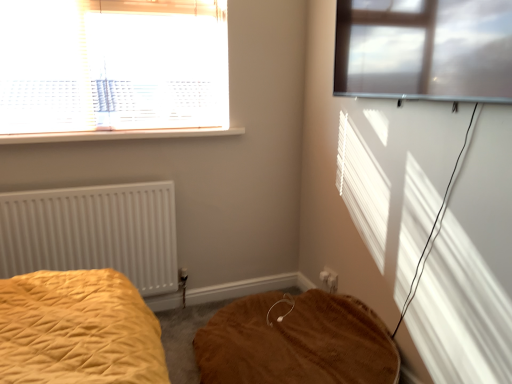
Question: Is white plastic window sill at upper left wider than white plastic window at upper left, positioned as the 2th window in right-to-left order?

Choices:
 (A) no
 (B) yes

Answer: (B)

Question: Is white plastic window sill at upper left not inside white plastic window at upper left, positioned as the 2th window in right-to-left order?

Choices:
 (A) no
 (B) yes

Answer: (B)

Question: Is the position of white plastic window sill at upper left more distant than that of white plastic window at upper left, placed as the first window when sorted from back to front?

Choices:
 (A) no
 (B) yes

Answer: (B)

Question: From the image's perspective, is white plastic window sill at upper left under white plastic window at upper left, the second window viewed from the front?

Choices:
 (A) yes
 (B) no

Answer: (A)

Question: Could white plastic window at upper left, the first window when ordered from left to right, be considered to be inside white plastic window sill at upper left?

Choices:
 (A) no
 (B) yes

Answer: (A)

Question: Considering the positions of brown plush mattress at lower center and white plastic window at upper left, the first window when ordered from left to right, in the image, is brown plush mattress at lower center bigger or smaller than white plastic window at upper left, the first window when ordered from left to right,?

Choices:
 (A) small
 (B) big

Answer: (B)

Question: Is brown plush mattress at lower center inside or outside of white plastic window at upper left, the second window viewed from the front?

Choices:
 (A) outside
 (B) inside

Answer: (A)

Question: From their relative heights in the image, would you say brown plush mattress at lower center is taller or shorter than white plastic window at upper left, the first window when ordered from left to right?

Choices:
 (A) short
 (B) tall

Answer: (A)

Question: Would you say brown plush mattress at lower center is to the left or to the right of white plastic window at upper left, the first window when ordered from left to right, in the picture?

Choices:
 (A) right
 (B) left

Answer: (A)

Question: In the image, is white plastic window at upper left, placed as the first window when sorted from back to front, positioned in front of or behind white plastic electric outlet at lower center?

Choices:
 (A) front
 (B) behind

Answer: (A)

Question: From the image's perspective, relative to white plastic electric outlet at lower center, is white plastic window at upper left, the first window when ordered from left to right, above or below?

Choices:
 (A) above
 (B) below

Answer: (A)

Question: Based on their sizes in the image, would you say white plastic window at upper left, the first window when ordered from left to right, is bigger or smaller than white plastic electric outlet at lower center?

Choices:
 (A) big
 (B) small

Answer: (A)

Question: Based on their positions, is white plastic window at upper left, the first window when ordered from left to right, located to the left or right of white plastic electric outlet at lower center?

Choices:
 (A) right
 (B) left

Answer: (B)

Question: From a real-world perspective, relative to brown plush mattress at lower center, is white matte radiator at left vertically above or below?

Choices:
 (A) below
 (B) above

Answer: (B)

Question: Which is correct: white matte radiator at left is inside brown plush mattress at lower center, or outside of it?

Choices:
 (A) inside
 (B) outside

Answer: (B)